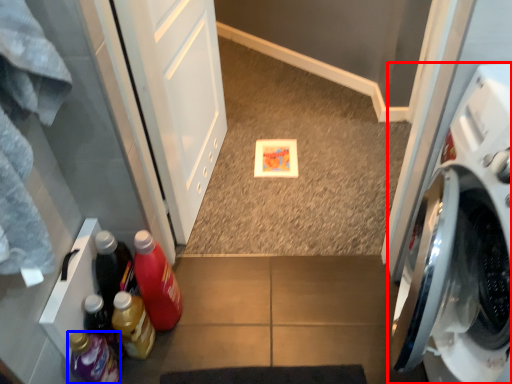
Question: Which object is closer to the camera taking this photo, washing machine (highlighted by a red box) or bottle (highlighted by a blue box)?

Choices:
 (A) washing machine
 (B) bottle

Answer: (A)